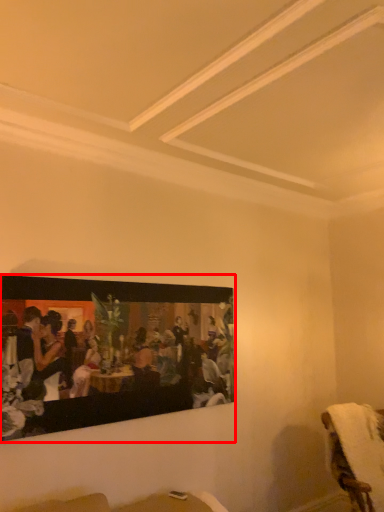
Question: From the image's perspective, what is the correct spatial relationship of picture frame (annotated by the red box) in relation to furniture?

Choices:
 (A) above
 (B) below

Answer: (A)